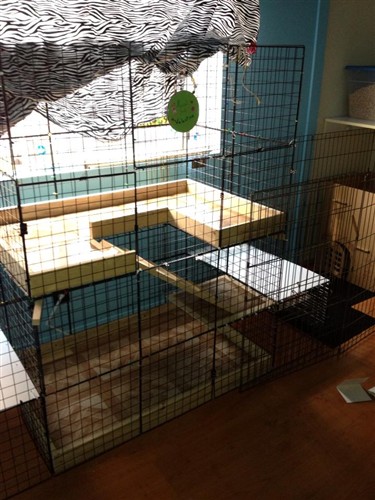
Locate an element on the screen. This screenshot has height=500, width=375. shelf is located at coordinates (78, 262).